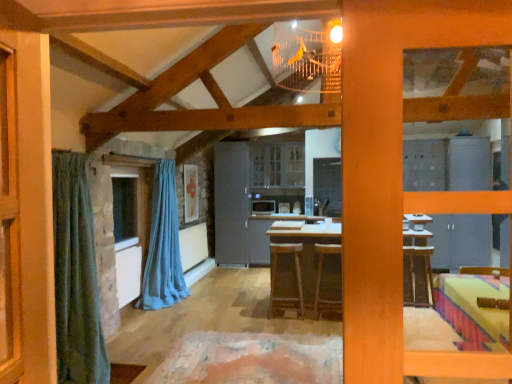
Question: Considering the relative positions of wooden table at center and brown wooden stool at center, positioned as the 2th stool in left-to-right order, in the image provided, is wooden table at center to the right of brown wooden stool at center, positioned as the 2th stool in left-to-right order, from the viewer's perspective?

Choices:
 (A) yes
 (B) no

Answer: (B)

Question: Is wooden table at center positioned before brown wooden stool at center, which is counted as the 1th stool, starting from the right?

Choices:
 (A) yes
 (B) no

Answer: (B)

Question: Is wooden table at center thinner than brown wooden stool at center, which is counted as the 1th stool, starting from the right?

Choices:
 (A) yes
 (B) no

Answer: (B)

Question: Does wooden table at center have a greater height compared to brown wooden stool at center, which is counted as the 1th stool, starting from the right?

Choices:
 (A) no
 (B) yes

Answer: (B)

Question: Is wooden table at center bigger than brown wooden stool at center, which is counted as the 1th stool, starting from the right?

Choices:
 (A) yes
 (B) no

Answer: (A)

Question: Is clear glass window at center to the left or to the right of wooden table at center in the image?

Choices:
 (A) left
 (B) right

Answer: (A)

Question: Does point (131, 221) appear closer or farther from the camera than point (323, 221)?

Choices:
 (A) closer
 (B) farther

Answer: (A)

Question: Considering the positions of clear glass window at center and wooden table at center in the image, is clear glass window at center bigger or smaller than wooden table at center?

Choices:
 (A) big
 (B) small

Answer: (B)

Question: Is clear glass window at center situated inside wooden table at center or outside?

Choices:
 (A) inside
 (B) outside

Answer: (B)

Question: Relative to gray matte refrigerator at center, is clear glass window at center in front or behind?

Choices:
 (A) behind
 (B) front

Answer: (B)

Question: Does point (115, 201) appear closer or farther from the camera than point (246, 162)?

Choices:
 (A) closer
 (B) farther

Answer: (A)

Question: Choose the correct answer: Is clear glass window at center inside gray matte refrigerator at center or outside it?

Choices:
 (A) outside
 (B) inside

Answer: (A)

Question: Considering the positions of clear glass window at center and gray matte refrigerator at center in the image, is clear glass window at center bigger or smaller than gray matte refrigerator at center?

Choices:
 (A) small
 (B) big

Answer: (A)

Question: From a real-world perspective, is clear glass window at center physically located above or below satin silver microwave at center?

Choices:
 (A) above
 (B) below

Answer: (A)

Question: Is clear glass window at center to the left or to the right of satin silver microwave at center in the image?

Choices:
 (A) left
 (B) right

Answer: (A)